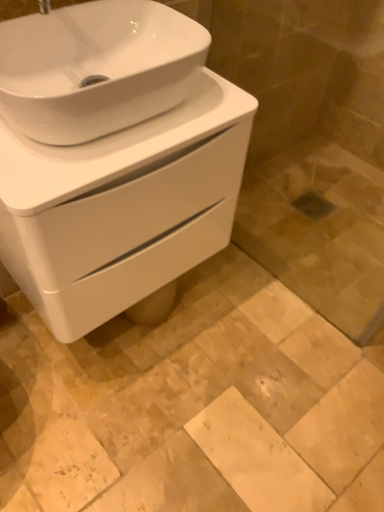
What do you see at coordinates (193, 406) in the screenshot?
I see `beige marble tile at center` at bounding box center [193, 406].

Identify the location of beige marble tile at center. This screenshot has width=384, height=512. (193, 406).

The width and height of the screenshot is (384, 512). Describe the element at coordinates (96, 68) in the screenshot. I see `white glossy sink at upper left` at that location.

Describe the element at coordinates (122, 207) in the screenshot. The height and width of the screenshot is (512, 384). I see `white glossy sink at center` at that location.

At what (x,y) coordinates should I click in order to perform the action: click on transparent glass door at lower right. Please return your answer as a coordinate pair (x, y). Looking at the image, I should click on (312, 147).

At what (x,y) coordinates should I click in order to perform the action: click on beige marble tile at center. Please return your answer as a coordinate pair (x, y). Looking at the image, I should click on (193, 406).

How different are the orientations of white glossy sink at upper left and transparent glass door at lower right in degrees?

89.9 degrees separate the facing orientations of white glossy sink at upper left and transparent glass door at lower right.

Considering the sizes of white glossy sink at upper left and transparent glass door at lower right in the image, is white glossy sink at upper left wider or thinner than transparent glass door at lower right?

white glossy sink at upper left is wider than transparent glass door at lower right.

Between point (8, 38) and point (347, 178), which one is positioned behind?

The point (347, 178) is behind.

Which of these two, white glossy sink at upper left or transparent glass door at lower right, stands taller?

transparent glass door at lower right.

I want to click on glass door in front of the beige marble tile at center, so (x=312, y=147).

Is transparent glass door at lower right located outside beige marble tile at center?

Yes, transparent glass door at lower right is located beyond the bounds of beige marble tile at center.

From the picture: Would you say transparent glass door at lower right is a long distance from beige marble tile at center?

transparent glass door at lower right is near beige marble tile at center, not far away.

Which object is wider, beige marble tile at center or white glossy sink at upper left?

beige marble tile at center.

From a real-world perspective, which object stands above the other?

white glossy sink at upper left is physically above.

Does beige marble tile at center have a lesser height compared to white glossy sink at upper left?

Correct, beige marble tile at center is not as tall as white glossy sink at upper left.

Would you say beige marble tile at center is a long distance from transparent glass door at lower right?

No, beige marble tile at center is not far away from transparent glass door at lower right.

From the picture: Is beige marble tile at center closer to the viewer compared to transparent glass door at lower right?

No, the depth of beige marble tile at center is greater than that of transparent glass door at lower right.

From their relative heights in the image, would you say white glossy sink at center is taller or shorter than transparent glass door at lower right?

white glossy sink at center is shorter than transparent glass door at lower right.

Is white glossy sink at center located outside transparent glass door at lower right?

Yes, white glossy sink at center is located beyond the bounds of transparent glass door at lower right.

This screenshot has width=384, height=512. Identify the location of glass door that appears behind the white glossy sink at center. (312, 147).

Considering the relative positions of white glossy sink at center and transparent glass door at lower right in the image provided, is white glossy sink at center to the left or to the right of transparent glass door at lower right?

white glossy sink at center is to the left of transparent glass door at lower right.

Is white glossy sink at upper left far away from beige marble tile at center?

white glossy sink at upper left is near beige marble tile at center, not far away.

Which of these two, white glossy sink at upper left or beige marble tile at center, stands taller?

white glossy sink at upper left is taller.

From the image's perspective, does white glossy sink at upper left appear lower than beige marble tile at center?

Incorrect, from the image's perspective, white glossy sink at upper left is higher than beige marble tile at center.

Considering the positions of objects white glossy sink at center and beige marble tile at center in the image provided, who is more to the left, white glossy sink at center or beige marble tile at center?

Positioned to the left is white glossy sink at center.

From a real-world perspective, who is located higher, white glossy sink at center or beige marble tile at center?

white glossy sink at center, from a real-world perspective.

How different are the orientations of white glossy sink at center and beige marble tile at center in degrees?

89.6 degrees separate the facing orientations of white glossy sink at center and beige marble tile at center.

At what (x,y) coordinates should I click in order to perform the action: click on glass door located underneath the white glossy sink at upper left (from a real-world perspective). Please return your answer as a coordinate pair (x, y). The width and height of the screenshot is (384, 512). Looking at the image, I should click on (312, 147).

This screenshot has width=384, height=512. Find the location of `glass door lying on the left of beige marble tile at center`. glass door lying on the left of beige marble tile at center is located at coordinates (312, 147).

Estimate the real-world distances between objects in this image. Which object is further from transparent glass door at lower right, white glossy sink at upper left or beige marble tile at center?

white glossy sink at upper left is further to transparent glass door at lower right.

Based on their spatial positions, is beige marble tile at center or white glossy sink at center closer to transparent glass door at lower right?

The object closer to transparent glass door at lower right is beige marble tile at center.

Looking at the image, which one is located further to white glossy sink at center, beige marble tile at center or transparent glass door at lower right?

Based on the image, transparent glass door at lower right appears to be further to white glossy sink at center.

From the image, which object appears to be nearer to white glossy sink at upper left, transparent glass door at lower right or white glossy sink at center?

Based on the image, white glossy sink at center appears to be nearer to white glossy sink at upper left.

From the image, which object appears to be nearer to beige marble tile at center, transparent glass door at lower right or white glossy sink at center?

The object closer to beige marble tile at center is white glossy sink at center.

Which object lies further to the anchor point white glossy sink at center, white glossy sink at upper left or transparent glass door at lower right?

transparent glass door at lower right is positioned further to the anchor white glossy sink at center.

When comparing their distances from white glossy sink at center, does transparent glass door at lower right or beige marble tile at center seem closer?

beige marble tile at center lies closer to white glossy sink at center than the other object.

Which object lies nearer to the anchor point transparent glass door at lower right, beige marble tile at center or white glossy sink at upper left?

beige marble tile at center is positioned closer to the anchor transparent glass door at lower right.

This screenshot has width=384, height=512. In order to click on sink situated between white glossy sink at center and transparent glass door at lower right from left to right in this screenshot , I will do `click(96, 68)`.

Where is `glass door between white glossy sink at upper left and beige marble tile at center from top to bottom`? This screenshot has width=384, height=512. glass door between white glossy sink at upper left and beige marble tile at center from top to bottom is located at coordinates (312, 147).

Identify the location of sink located between white glossy sink at center and beige marble tile at center in the left-right direction. This screenshot has height=512, width=384. (96, 68).

At what (x,y) coordinates should I click in order to perform the action: click on glass door between white glossy sink at center and beige marble tile at center. Please return your answer as a coordinate pair (x, y). This screenshot has height=512, width=384. Looking at the image, I should click on (312, 147).